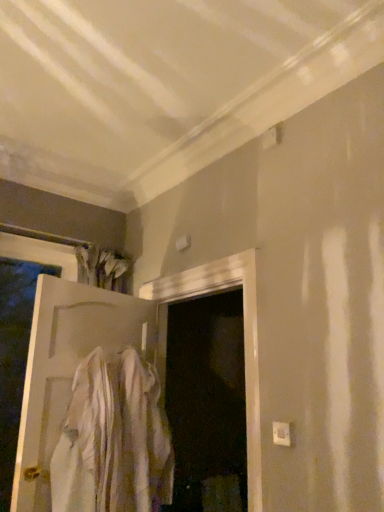
Question: Is white cotton shirt at center positioned before white matte door at left?

Choices:
 (A) yes
 (B) no

Answer: (A)

Question: Is white cotton shirt at center outside of white matte door at left?

Choices:
 (A) yes
 (B) no

Answer: (A)

Question: From a real-world perspective, is white cotton shirt at center below white matte door at left?

Choices:
 (A) yes
 (B) no

Answer: (A)

Question: Is white cotton shirt at center positioned with its back to white matte door at left?

Choices:
 (A) yes
 (B) no

Answer: (A)

Question: Can you confirm if white cotton shirt at center is shorter than white matte door at left?

Choices:
 (A) no
 (B) yes

Answer: (B)

Question: Does white cotton shirt at center turn towards white matte door at left?

Choices:
 (A) no
 (B) yes

Answer: (A)

Question: From the image's perspective, would you say white matte door at left is positioned over white cotton shirt at center?

Choices:
 (A) yes
 (B) no

Answer: (A)

Question: From a real-world perspective, is white matte door at left below white cotton shirt at center?

Choices:
 (A) yes
 (B) no

Answer: (B)

Question: Does white matte door at left lie behind white cotton shirt at center?

Choices:
 (A) no
 (B) yes

Answer: (B)

Question: Is white matte door at left turned away from white cotton shirt at center?

Choices:
 (A) yes
 (B) no

Answer: (A)

Question: Is white matte door at left positioned in front of white cotton shirt at center?

Choices:
 (A) yes
 (B) no

Answer: (B)

Question: From a real-world perspective, is white matte door at left physically above white cotton shirt at center?

Choices:
 (A) yes
 (B) no

Answer: (A)

Question: From a real-world perspective, is white matte door at left above or below white cotton shirt at center?

Choices:
 (A) below
 (B) above

Answer: (B)